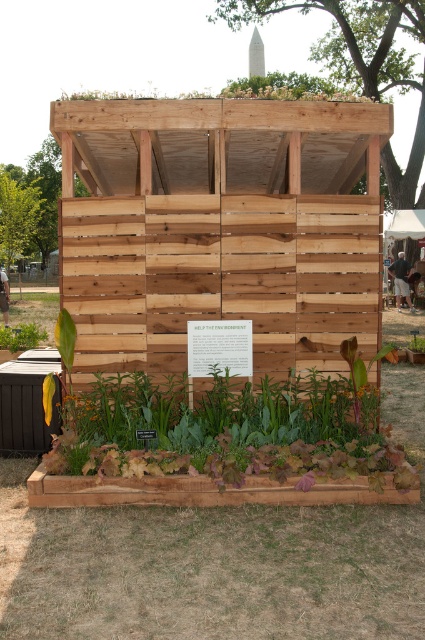
Can you confirm if natural wood shed at center is positioned above green leafy plant at lower left?

Indeed, natural wood shed at center is positioned over green leafy plant at lower left.

In the scene shown: Who is more distant from viewer, (142,285) or (22,332)?

The point (22,332) is behind.

Where is `natural wood shed at center`? natural wood shed at center is located at coordinates (218, 228).